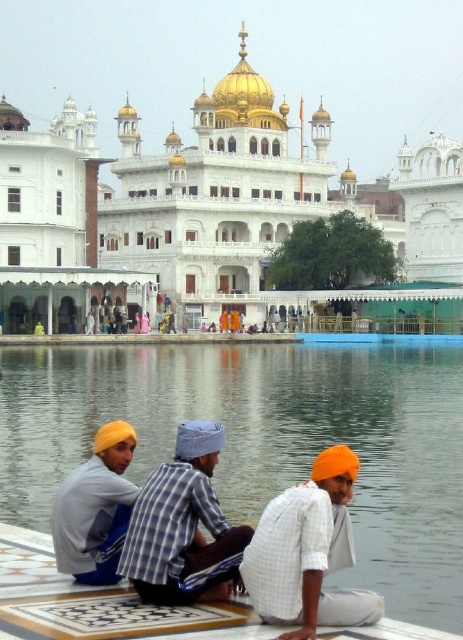
Question: Is blue plaid shirt at center positioned behind yellow turban at lower left?

Choices:
 (A) no
 (B) yes

Answer: (A)

Question: Which point appears farthest from the camera in this image?

Choices:
 (A) (76, 564)
 (B) (193, 554)
 (C) (348, 422)
 (D) (318, 605)

Answer: (C)

Question: Can you confirm if clear water at lower center is thinner than yellow turban at lower left?

Choices:
 (A) no
 (B) yes

Answer: (A)

Question: Which object appears closest to the camera in this image?

Choices:
 (A) white marble palace at center
 (B) yellow turban at lower left
 (C) clear water at lower center

Answer: (B)

Question: Among these objects, which one is nearest to the camera?

Choices:
 (A) white marble palace at center
 (B) blue plaid shirt at center
 (C) clear water at lower center
 (D) orange matte turban at lower center

Answer: (D)

Question: Does orange matte turban at lower center lie in front of blue plaid shirt at center?

Choices:
 (A) yes
 (B) no

Answer: (A)